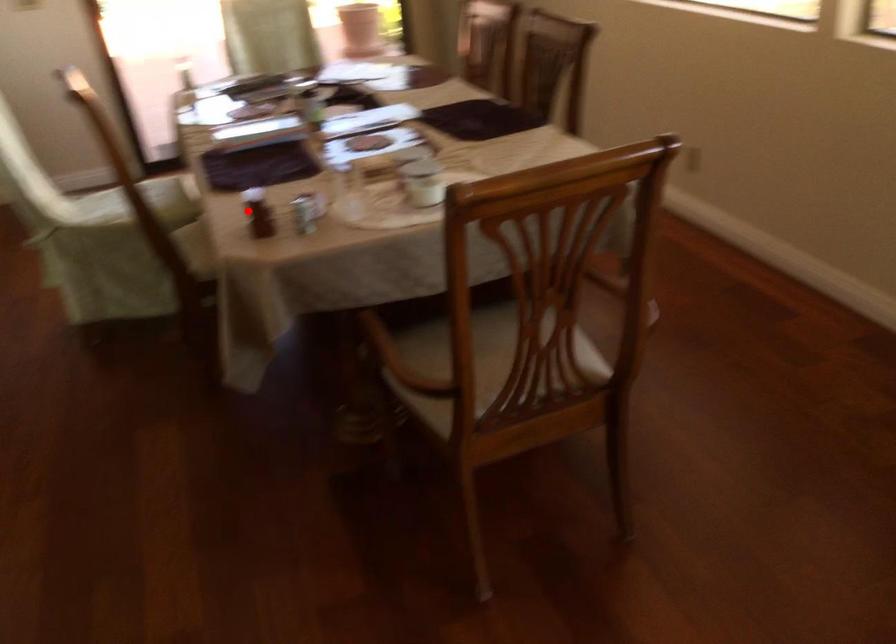
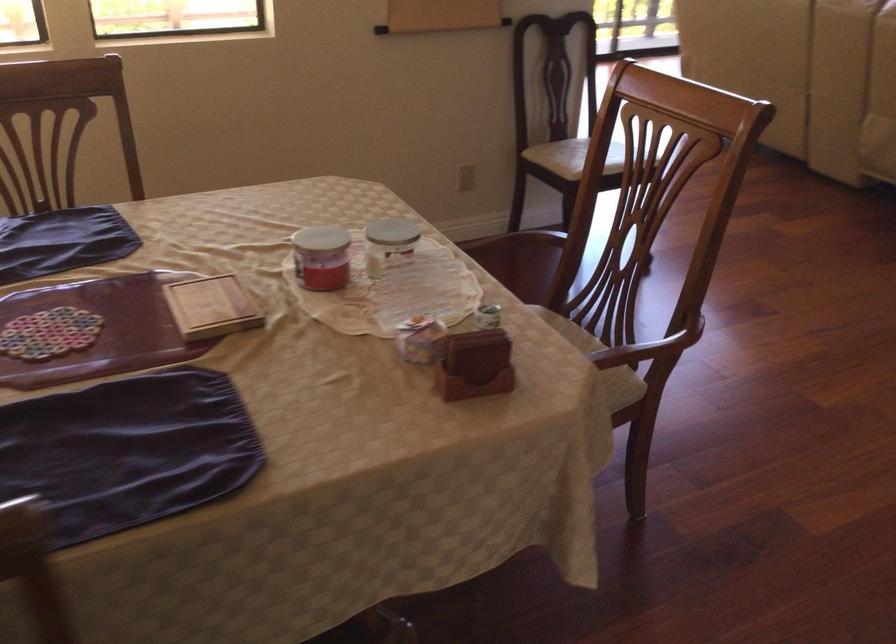
Question: I am providing you with two images of the same scene from different viewpoints. Given a red point in image1, look at the same physical point in image2. Is it:

Choices:
 (A) Closer to the viewpoint
 (B) Farther from the viewpoint

Answer: (A)